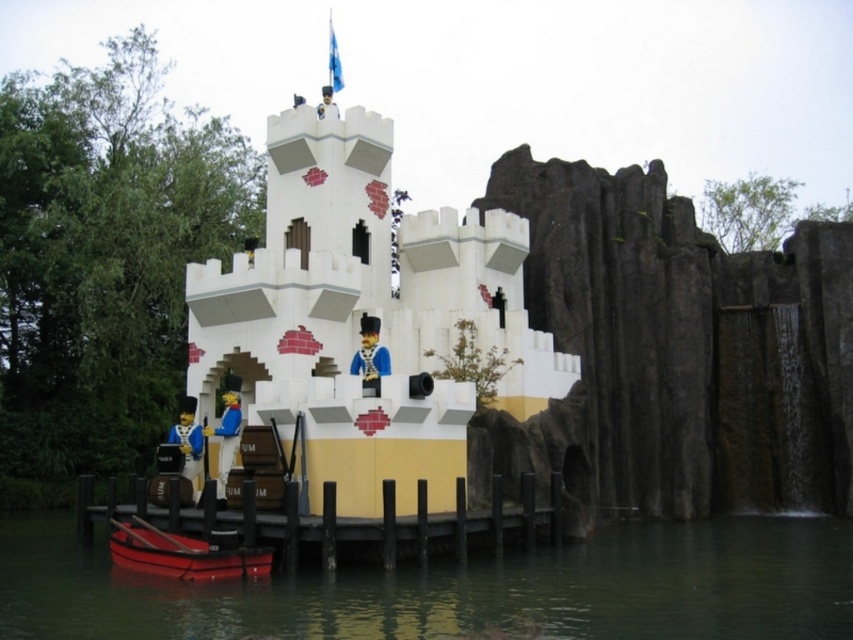
Is green matte water at lower center behind smooth wood dock at lower center?

No, green matte water at lower center is in front of smooth wood dock at lower center.

Which is behind, point (561, 557) or point (196, 573)?

Point (561, 557)

The height and width of the screenshot is (640, 853). Find the location of `green matte water at lower center`. green matte water at lower center is located at coordinates (460, 588).

Is point (415, 228) farther from viewer compared to point (137, 560)?

That is True.

Find the location of a particular element. white plastic castle at center is located at coordinates (364, 316).

Can you confirm if green matte water at lower center is shorter than shiny red boat at lower left?

No.

Measure the distance between green matte water at lower center and camera.

green matte water at lower center and camera are 38.08 meters apart from each other.

Between point (277, 632) and point (192, 570), which one is positioned in front?

Point (277, 632) is more forward.

The width and height of the screenshot is (853, 640). Find the location of `green matte water at lower center`. green matte water at lower center is located at coordinates (460, 588).